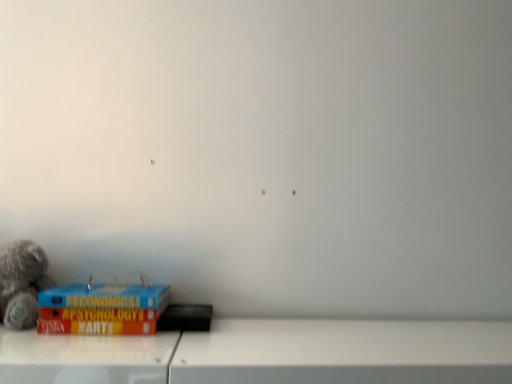
Find the location of a particular element. The image size is (512, 384). blank space above blue hardcover book at lower left (from a real-world perspective) is located at coordinates (106, 288).